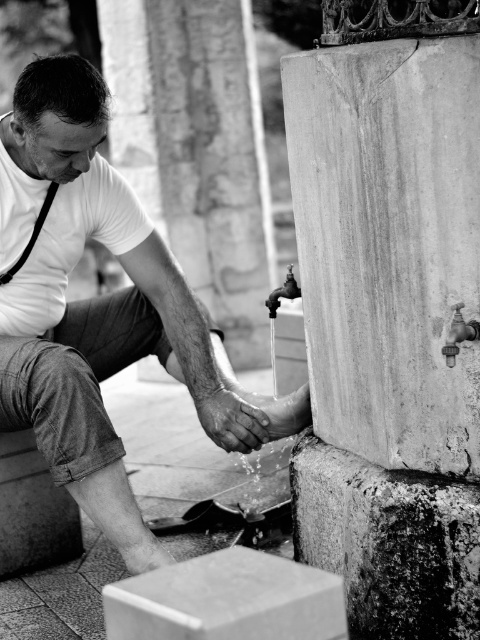
Question: Is smooth stone pillar at right positioned before black leather suspenders at left?

Choices:
 (A) no
 (B) yes

Answer: (B)

Question: Among these points, which one is nearest to the camera?

Choices:
 (A) (50, 310)
 (B) (290, 112)
 (C) (44, 202)

Answer: (B)

Question: Where is smooth stone pillar at right located in relation to black leather suspenders at left in the image?

Choices:
 (A) right
 (B) left

Answer: (A)

Question: Is smooth stone pillar at right positioned at the back of matte white shirt at left?

Choices:
 (A) no
 (B) yes

Answer: (A)

Question: Which object is closer to the camera taking this photo?

Choices:
 (A) black leather suspenders at left
 (B) matte white shirt at left

Answer: (B)

Question: Which is farther from the matte white shirt at left?

Choices:
 (A) black leather suspenders at left
 (B) smooth stone pillar at right

Answer: (B)